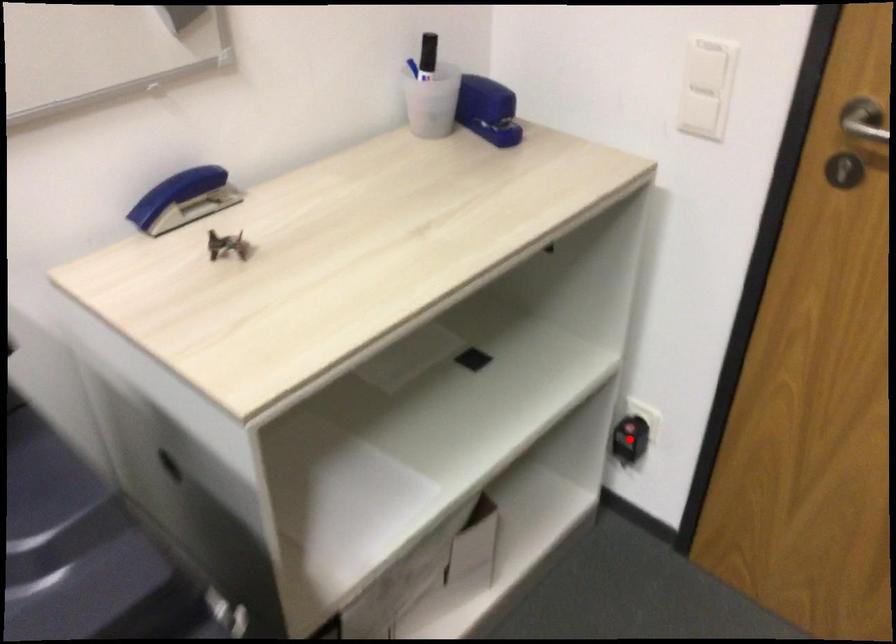
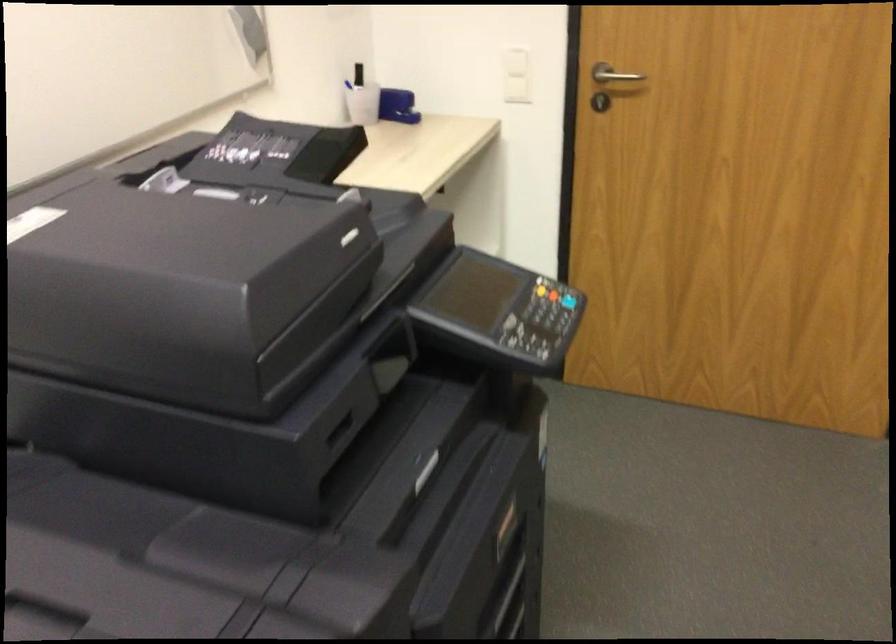
Question: I am providing you with two images of the same scene from different viewpoints. A red point is marked on the first image. Can you still see the location of the red point in image 2?

Choices:
 (A) Yes
 (B) No

Answer: (B)